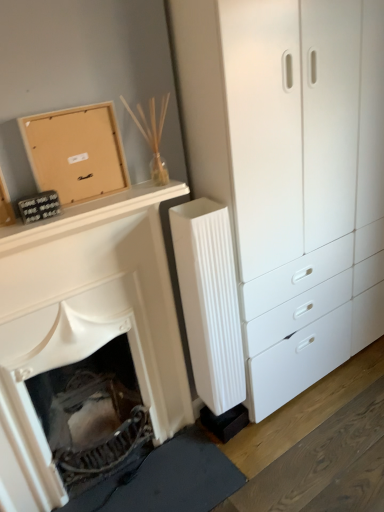
What do you see at coordinates (291, 173) in the screenshot? I see `white plastic chest of drawers at center-right` at bounding box center [291, 173].

What do you see at coordinates (76, 152) in the screenshot?
I see `matte brown cardboard at upper left` at bounding box center [76, 152].

Where is `matte brown cardboard at upper left`? matte brown cardboard at upper left is located at coordinates (76, 152).

Identify the location of white plastic chest of drawers at center-right. (291, 173).

Can you confirm if white ribbed radiator at center is smaller than white plastic chest of drawers at center-right?

Yes, white ribbed radiator at center is smaller than white plastic chest of drawers at center-right.

From a real-world perspective, is white ribbed radiator at center on white plastic chest of drawers at center-right?

No, from a real-world perspective, white ribbed radiator at center is not over white plastic chest of drawers at center-right

Is white ribbed radiator at center not inside white plastic chest of drawers at center-right?

Indeed, white ribbed radiator at center is completely outside white plastic chest of drawers at center-right.

Between white ribbed radiator at center and white plastic chest of drawers at center-right, which one appears on the left side from the viewer's perspective?

white ribbed radiator at center is more to the left.

From a real-world perspective, which is physically below, white plastic chest of drawers at center-right or matte brown cardboard at upper left?

From a 3D spatial view, white plastic chest of drawers at center-right is below.

Image resolution: width=384 pixels, height=512 pixels. In order to click on cardboard box behind the white plastic chest of drawers at center-right in this screenshot , I will do `click(76, 152)`.

Is white plastic chest of drawers at center-right aimed at matte brown cardboard at upper left?

No, white plastic chest of drawers at center-right is not facing towards matte brown cardboard at upper left.

Considering the sizes of objects white plastic chest of drawers at center-right and matte brown cardboard at upper left in the image provided, who is smaller, white plastic chest of drawers at center-right or matte brown cardboard at upper left?

With smaller size is matte brown cardboard at upper left.

Based on the photo, from the image's perspective, is white plastic chest of drawers at center-right below white matte fireplace at lower left?

No.

From a real-world perspective, is white plastic chest of drawers at center-right beneath white matte fireplace at lower left?

No.

Considering the sizes of objects white plastic chest of drawers at center-right and white matte fireplace at lower left in the image provided, who is smaller, white plastic chest of drawers at center-right or white matte fireplace at lower left?

white matte fireplace at lower left.

Is white plastic chest of drawers at center-right positioned beyond the bounds of white matte fireplace at lower left?

Yes.

Does point (257, 287) appear closer or farther from the camera than point (226, 254)?

Point (257, 287).

From the picture: Which is more to the right, white plastic chest of drawers at center-right or white ribbed radiator at center?

white plastic chest of drawers at center-right is more to the right.

Is white plastic chest of drawers at center-right turned away from white ribbed radiator at center?

That's not correct — white plastic chest of drawers at center-right is not looking away from white ribbed radiator at center.

In the scene shown: From a real-world perspective, which is physically below, matte brown cardboard at upper left or white plastic chest of drawers at center-right?

In real-world perspective, white plastic chest of drawers at center-right is lower.

Would you say matte brown cardboard at upper left contains white plastic chest of drawers at center-right?

No, white plastic chest of drawers at center-right is not a part of matte brown cardboard at upper left.

Who is bigger, matte brown cardboard at upper left or white plastic chest of drawers at center-right?

white plastic chest of drawers at center-right.

Looking at this image, how different are the orientations of matte brown cardboard at upper left and white plastic chest of drawers at center-right in degrees?

The angle between the facing direction of matte brown cardboard at upper left and the facing direction of white plastic chest of drawers at center-right is 1.39 degrees.

Looking at this image, is matte brown cardboard at upper left inside the boundaries of white matte fireplace at lower left, or outside?

The correct answer is: outside.

Can you confirm if matte brown cardboard at upper left is wider than white matte fireplace at lower left?

No.

Is point (111, 175) less distant than point (164, 340)?

Yes, point (111, 175) is closer to viewer.

Is matte brown cardboard at upper left bigger or smaller than white matte fireplace at lower left?

matte brown cardboard at upper left is smaller than white matte fireplace at lower left.

Would you say white matte fireplace at lower left is to the left or to the right of white plastic chest of drawers at center-right in the picture?

Answer: white matte fireplace at lower left is positioned on white plastic chest of drawers at center-right's left side.

Looking at this image, considering the relative sizes of white matte fireplace at lower left and white plastic chest of drawers at center-right in the image provided, is white matte fireplace at lower left thinner than white plastic chest of drawers at center-right?

Yes, white matte fireplace at lower left is thinner than white plastic chest of drawers at center-right.

Considering the relative sizes of white matte fireplace at lower left and white plastic chest of drawers at center-right in the image provided, is white matte fireplace at lower left taller than white plastic chest of drawers at center-right?

In fact, white matte fireplace at lower left may be shorter than white plastic chest of drawers at center-right.

Is white matte fireplace at lower left completely or partially outside of white plastic chest of drawers at center-right?

Yes.

I want to click on radiator lying on the left of white plastic chest of drawers at center-right, so click(x=209, y=301).

The height and width of the screenshot is (512, 384). I want to click on cardboard box behind the white plastic chest of drawers at center-right, so click(76, 152).

Looking at the image, which one is located closer to white ribbed radiator at center, matte brown cardboard at upper left or white plastic chest of drawers at center-right?

white plastic chest of drawers at center-right.

When comparing their distances from matte brown cardboard at upper left, does white ribbed radiator at center or white plastic chest of drawers at center-right seem further?

white plastic chest of drawers at center-right is further to matte brown cardboard at upper left.

In the scene shown: Estimate the real-world distances between objects in this image. Which object is further from white plastic chest of drawers at center-right, white matte fireplace at lower left or matte brown cardboard at upper left?

Among the two, matte brown cardboard at upper left is located further to white plastic chest of drawers at center-right.

Estimate the real-world distances between objects in this image. Which object is closer to matte brown cardboard at upper left, white ribbed radiator at center or white matte fireplace at lower left?

white matte fireplace at lower left is closer to matte brown cardboard at upper left.

Considering their positions, is white ribbed radiator at center positioned closer to white matte fireplace at lower left than white plastic chest of drawers at center-right?

white ribbed radiator at center lies closer to white matte fireplace at lower left than the other object.

Which object lies nearer to the anchor point white plastic chest of drawers at center-right, matte brown cardboard at upper left or white matte fireplace at lower left?

The object closer to white plastic chest of drawers at center-right is white matte fireplace at lower left.

Which object lies nearer to the anchor point matte brown cardboard at upper left, white matte fireplace at lower left or white ribbed radiator at center?

The object closer to matte brown cardboard at upper left is white matte fireplace at lower left.

Which object lies further to the anchor point white plastic chest of drawers at center-right, matte brown cardboard at upper left or white ribbed radiator at center?

matte brown cardboard at upper left lies further to white plastic chest of drawers at center-right than the other object.

Identify the location of radiator between matte brown cardboard at upper left and white plastic chest of drawers at center-right in the horizontal direction. (209, 301).

Locate an element on the screen. This screenshot has height=512, width=384. radiator between matte brown cardboard at upper left and white matte fireplace at lower left from top to bottom is located at coordinates (209, 301).

At what (x,y) coordinates should I click in order to perform the action: click on radiator located between white matte fireplace at lower left and white plastic chest of drawers at center-right in the left-right direction. Please return your answer as a coordinate pair (x, y). Looking at the image, I should click on (209, 301).

This screenshot has width=384, height=512. In order to click on cardboard box situated between white matte fireplace at lower left and white plastic chest of drawers at center-right from left to right in this screenshot , I will do `click(76, 152)`.